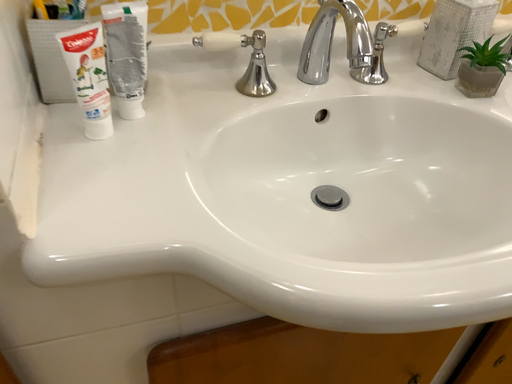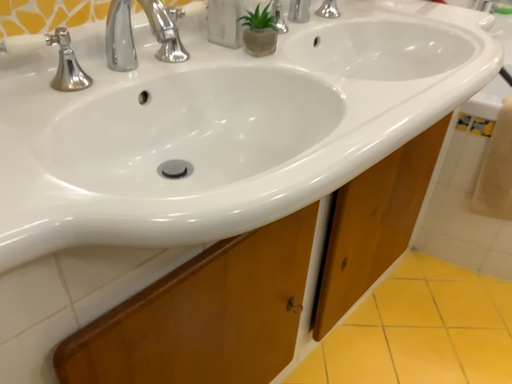
Question: Which way did the camera rotate in the video?

Choices:
 (A) rotated left
 (B) rotated right

Answer: (B)